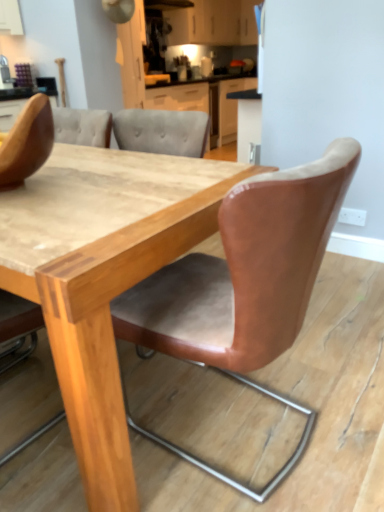
Locate an element on the screen. free spot to the right of leather-like tan chair at center, positioned as the second chair in left-to-right order is located at coordinates (345, 396).